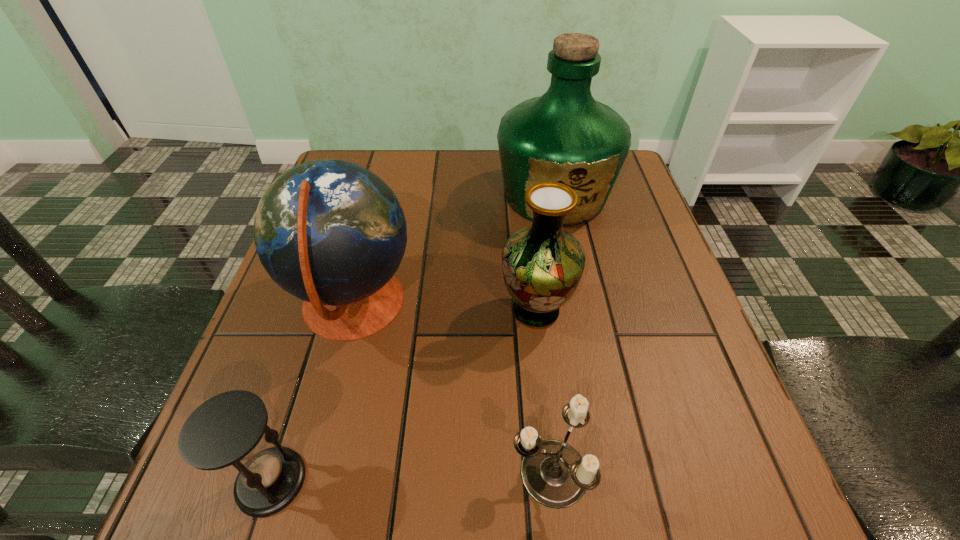
At what (x,y) coordinates should I click in order to perform the action: click on free space that satisfies the following two spatial constraints: 1. with the Americas facing the viewer on the globe; 2. on the front side of the hourglass. Please return your answer as a coordinate pair (x, y). This screenshot has width=960, height=540. Looking at the image, I should click on (306, 481).